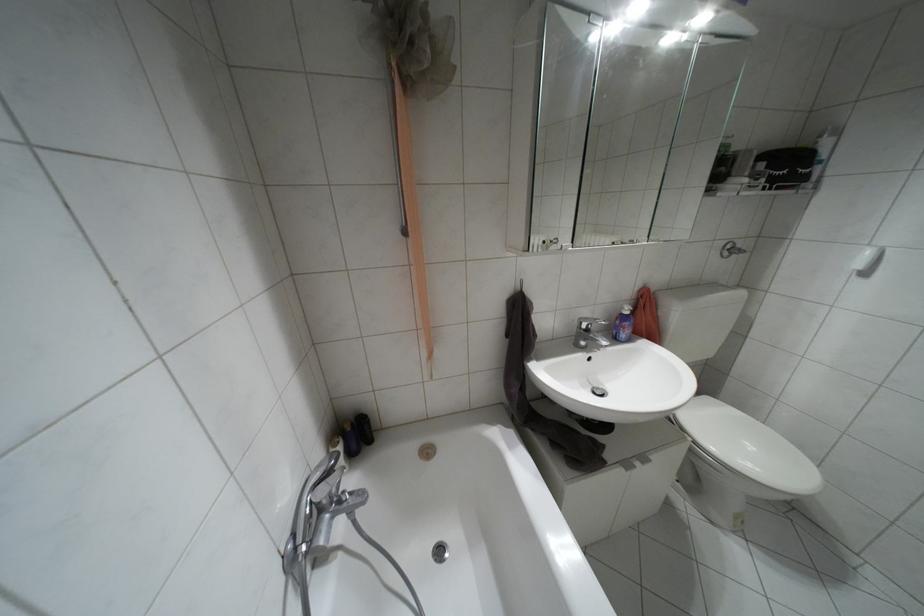
Identify the location of white toilet lid. This screenshot has height=616, width=924. (748, 447).